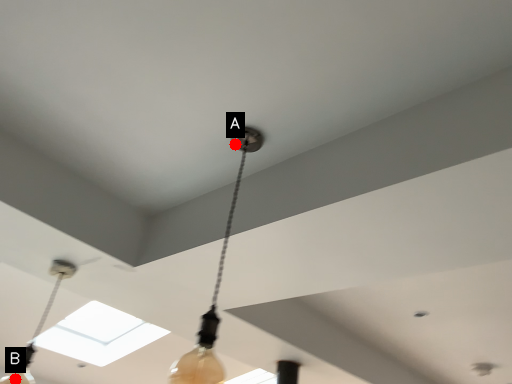
Question: Two points are circled on the image, labeled by A and B beside each circle. Which point is closer to the camera taking this photo?

Choices:
 (A) A is closer
 (B) B is closer

Answer: (A)